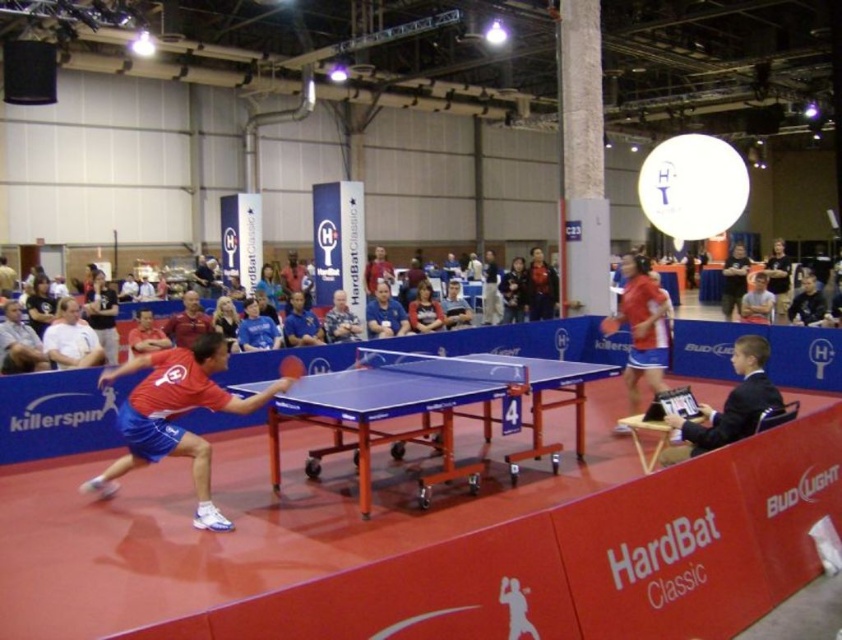
Does black suit at lower right have a larger size compared to blue glossy table tennis table at center?

Correct, black suit at lower right is larger in size than blue glossy table tennis table at center.

Who is positioned more to the left, black suit at lower right or blue glossy table tennis table at center?

blue glossy table tennis table at center

Does point (722, 408) come farther from viewer compared to point (284, 365)?

No, it is not.

This screenshot has height=640, width=842. I want to click on black suit at lower right, so click(729, 404).

Does matte red shirt at left lie in front of black suit at lower right?

No, it is behind black suit at lower right.

Can you confirm if matte red shirt at left is smaller than black suit at lower right?

Incorrect, matte red shirt at left is not smaller in size than black suit at lower right.

Between point (158, 397) and point (680, 419), which one is positioned in front?

Positioned in front is point (680, 419).

Find the location of a particular element. matte red shirt at left is located at coordinates 174,413.

Between blue plastic table tennis table at center and matte red shirt at center, which one is positioned higher?

matte red shirt at center is higher up.

Does blue plastic table tennis table at center have a lesser height compared to matte red shirt at center?

No.

Between point (318, 449) and point (633, 336), which one is positioned behind?

Positioned behind is point (633, 336).

This screenshot has width=842, height=640. In order to click on blue plastic table tennis table at center in this screenshot , I will do `click(430, 410)`.